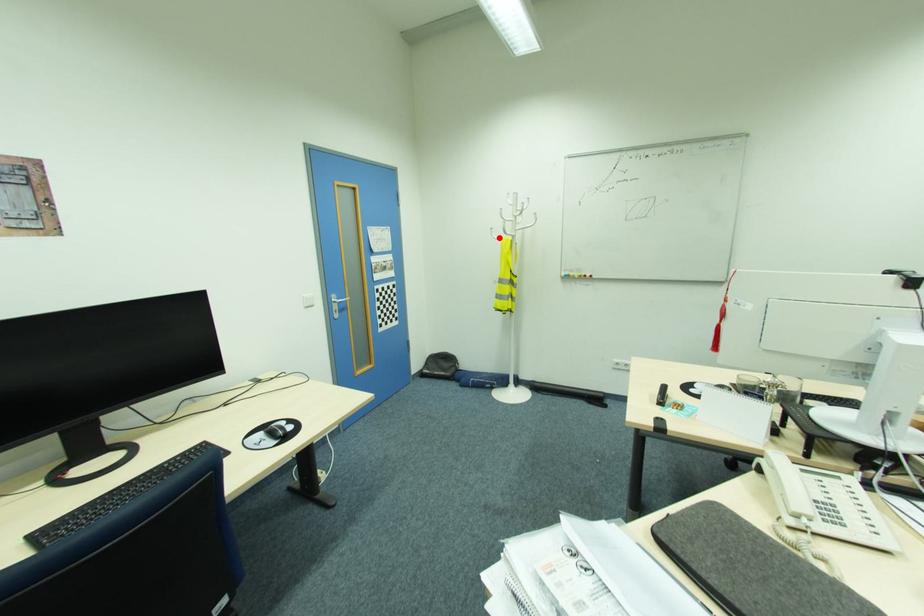
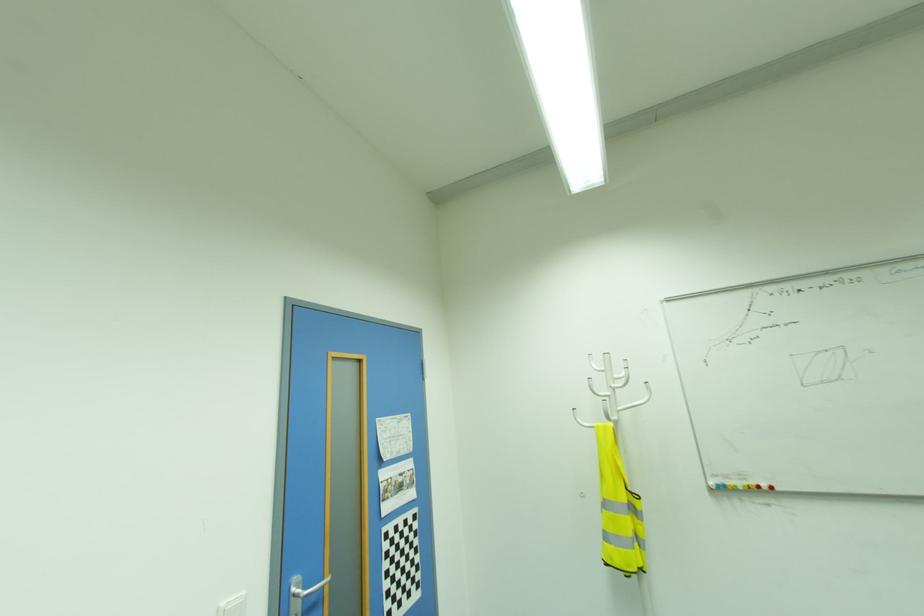
The point at the highlighted location is marked in the first image. Where is the corresponding point in the second image?

(589, 424)